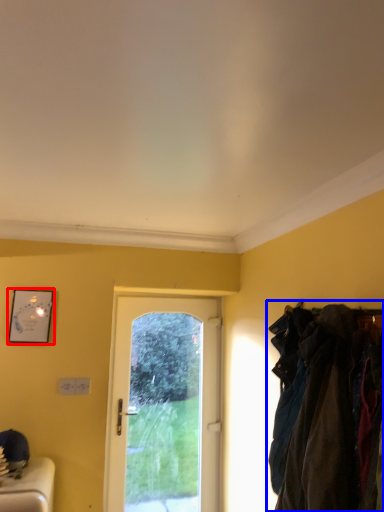
Question: Which of the following is the closest to the observer, picture frame (highlighted by a red box) or laundry (highlighted by a blue box)?

Choices:
 (A) picture frame
 (B) laundry

Answer: (B)